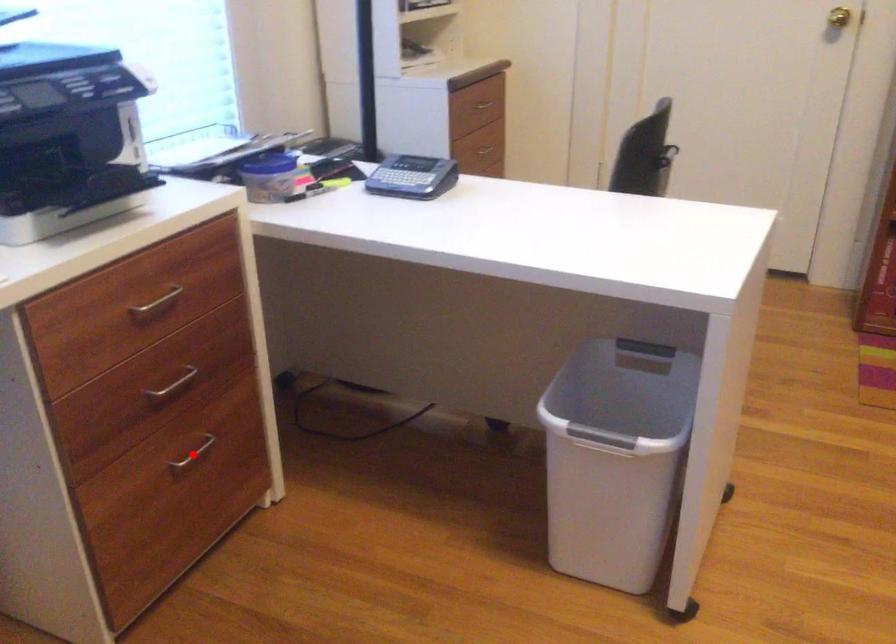
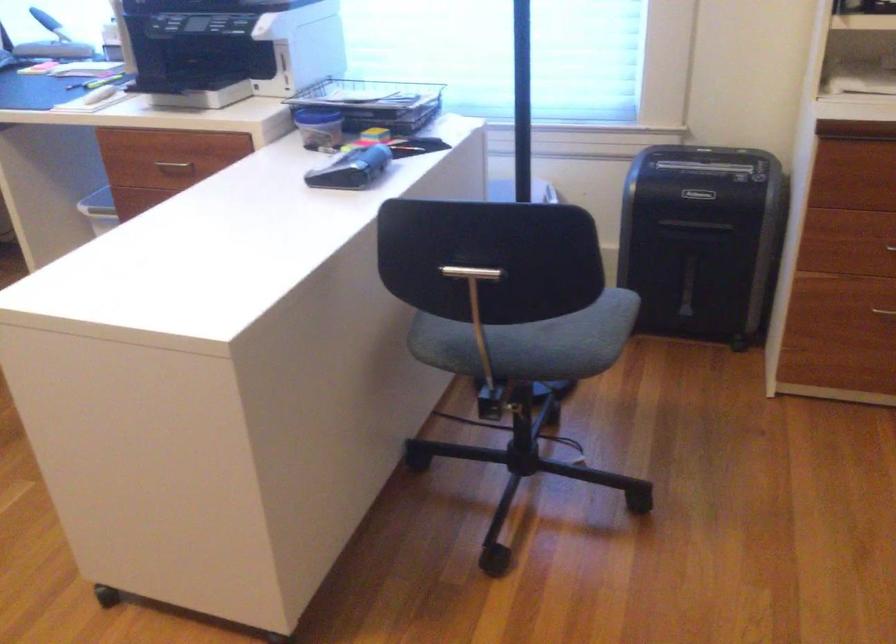
Question: I am providing you with two images of the same scene from different viewpoints. A red point is marked on the first image. At the location where the point appears in image 1, is it still visible in image 2?

Choices:
 (A) Yes
 (B) No

Answer: (B)